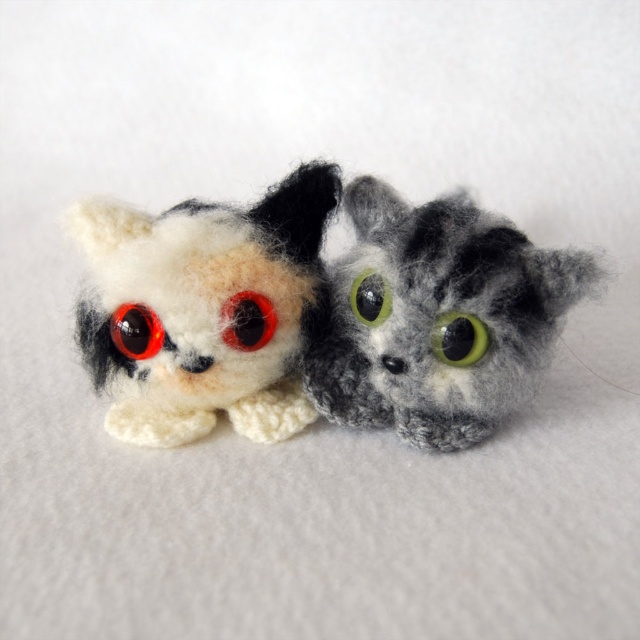
Question: Which of the following is the farthest from the observer?

Choices:
 (A) (230, 314)
 (B) (129, 339)

Answer: (B)

Question: Which of the following is the farthest from the observer?

Choices:
 (A) (460, 358)
 (B) (113, 340)

Answer: (B)

Question: Can you confirm if fluffy gray cat at center is bigger than green fuzzy eye at center?

Choices:
 (A) yes
 (B) no

Answer: (A)

Question: From the image, what is the correct spatial relationship of green matte eye at center in relation to matte red eye at left?

Choices:
 (A) left
 (B) right

Answer: (B)

Question: Is red felt eye at center below matte red eye at left?

Choices:
 (A) yes
 (B) no

Answer: (B)

Question: Which of the following is the farthest from the observer?

Choices:
 (A) (355, 284)
 (B) (132, 317)
 (C) (284, 337)

Answer: (A)